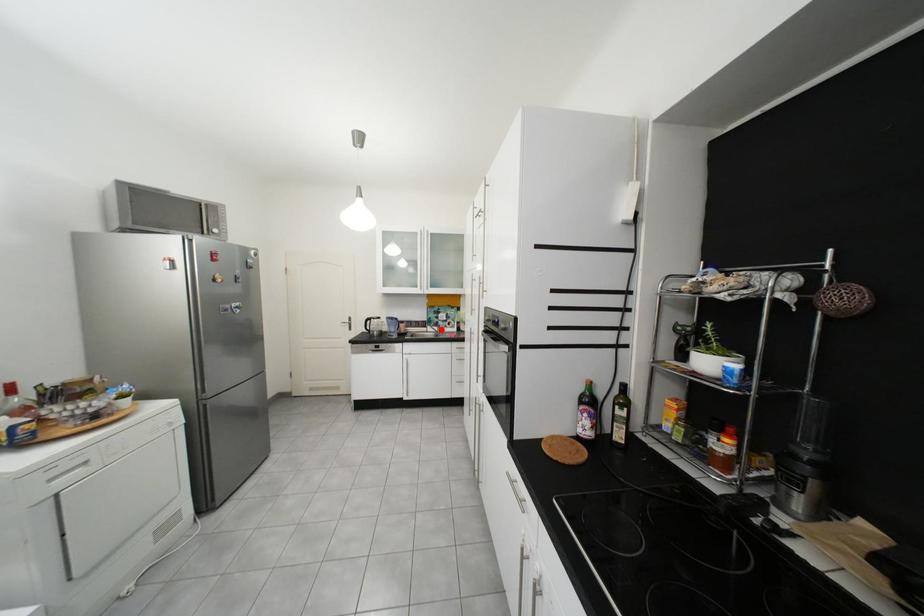
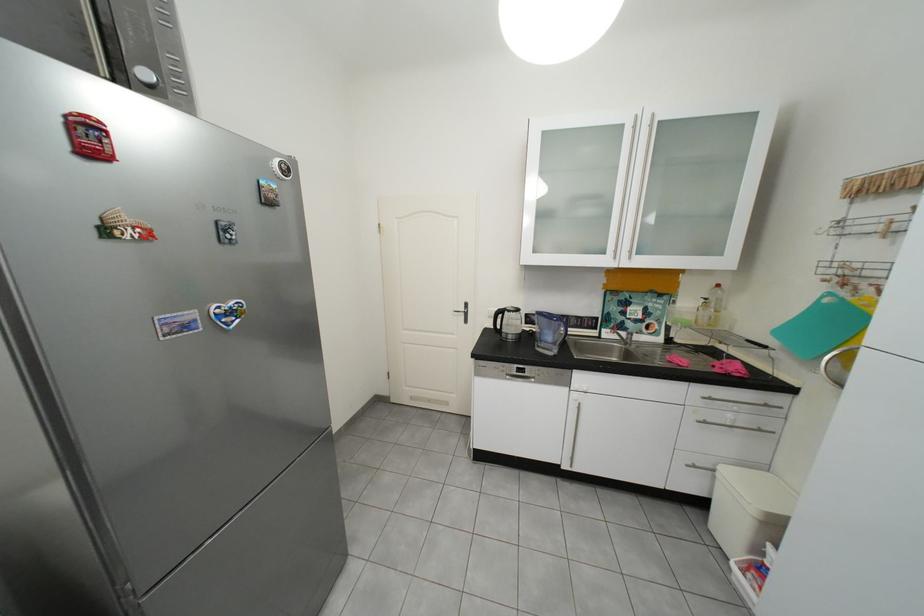
Locate, in the second image, the point that corresponds to the highlighted location in the first image.

(619, 334)